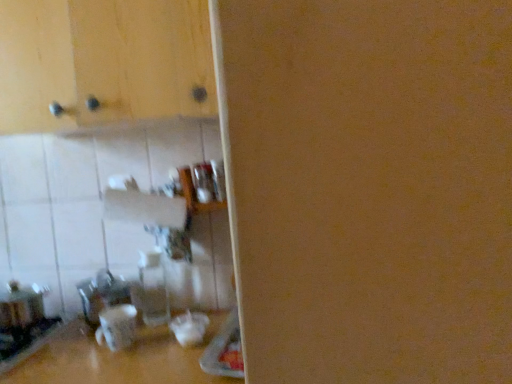
Question: From a real-world perspective, does transparent glass bottle at center sit lower than metallic silver toaster at lower left?

Choices:
 (A) yes
 (B) no

Answer: (B)

Question: Is transparent glass bottle at center smaller than metallic silver toaster at lower left?

Choices:
 (A) no
 (B) yes

Answer: (B)

Question: Does transparent glass bottle at center lie behind metallic silver toaster at lower left?

Choices:
 (A) no
 (B) yes

Answer: (B)

Question: From a real-world perspective, is transparent glass bottle at center positioned over metallic silver toaster at lower left based on gravity?

Choices:
 (A) no
 (B) yes

Answer: (B)

Question: Does transparent glass bottle at center lie in front of metallic silver toaster at lower left?

Choices:
 (A) yes
 (B) no

Answer: (B)

Question: Considering the positions of matte wood cabinet at upper left and transparent glass bottle at center in the image, is matte wood cabinet at upper left bigger or smaller than transparent glass bottle at center?

Choices:
 (A) small
 (B) big

Answer: (B)

Question: Considering their positions, is matte wood cabinet at upper left located in front of or behind transparent glass bottle at center?

Choices:
 (A) front
 (B) behind

Answer: (A)

Question: From their relative heights in the image, would you say matte wood cabinet at upper left is taller or shorter than transparent glass bottle at center?

Choices:
 (A) tall
 (B) short

Answer: (A)

Question: From the image's perspective, is matte wood cabinet at upper left located above or below transparent glass bottle at center?

Choices:
 (A) below
 (B) above

Answer: (B)

Question: From their relative heights in the image, would you say metallic silver toaster at lower left is taller or shorter than transparent glass bottle at center?

Choices:
 (A) short
 (B) tall

Answer: (A)

Question: Is metallic silver toaster at lower left to the left or to the right of transparent glass bottle at center in the image?

Choices:
 (A) left
 (B) right

Answer: (A)

Question: From a real-world perspective, is metallic silver toaster at lower left above or below transparent glass bottle at center?

Choices:
 (A) above
 (B) below

Answer: (B)

Question: Based on their sizes in the image, would you say metallic silver toaster at lower left is bigger or smaller than transparent glass bottle at center?

Choices:
 (A) small
 (B) big

Answer: (B)

Question: Looking at their shapes, would you say transparent glass bottle at center is wider or thinner than metallic silver toaster at lower left?

Choices:
 (A) wide
 (B) thin

Answer: (B)

Question: Is point (154, 314) closer or farther from the camera than point (15, 319)?

Choices:
 (A) farther
 (B) closer

Answer: (A)